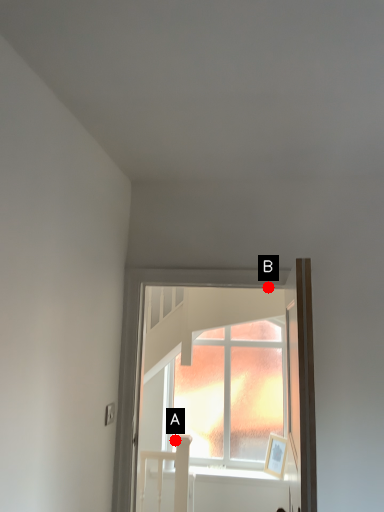
Question: Two points are circled on the image, labeled by A and B beside each circle. Among these points, which one is nearest to the camera?

Choices:
 (A) A is closer
 (B) B is closer

Answer: (B)